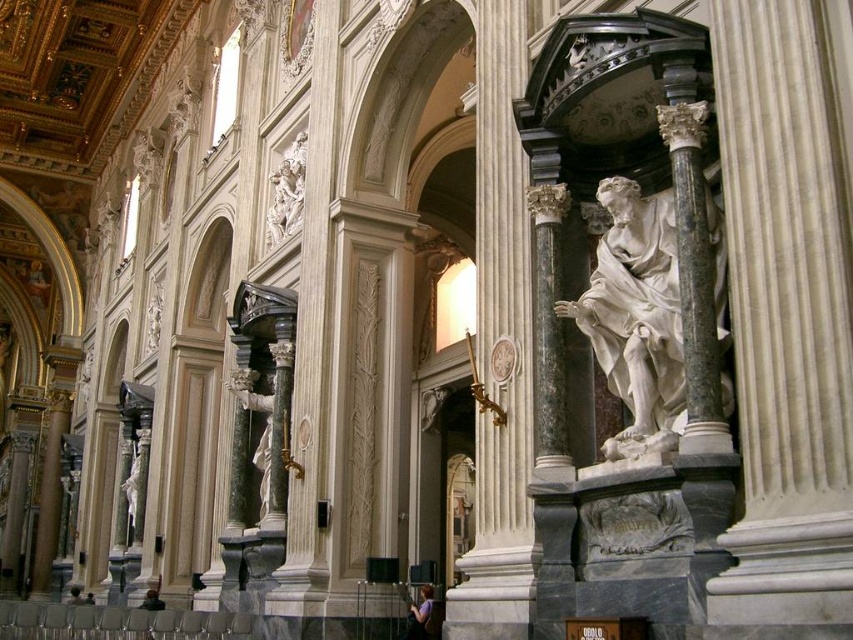
Question: Can you confirm if white marble statue at center is positioned below white marble statue at upper left?

Choices:
 (A) yes
 (B) no

Answer: (A)

Question: Which of the following is the closest to the observer?

Choices:
 (A) (270, 228)
 (B) (712, 237)

Answer: (B)

Question: Does white marble statue at center appear on the left side of white marble statue at upper left?

Choices:
 (A) no
 (B) yes

Answer: (A)

Question: Can you confirm if white marble statue at center is smaller than white marble statue at upper left?

Choices:
 (A) yes
 (B) no

Answer: (B)